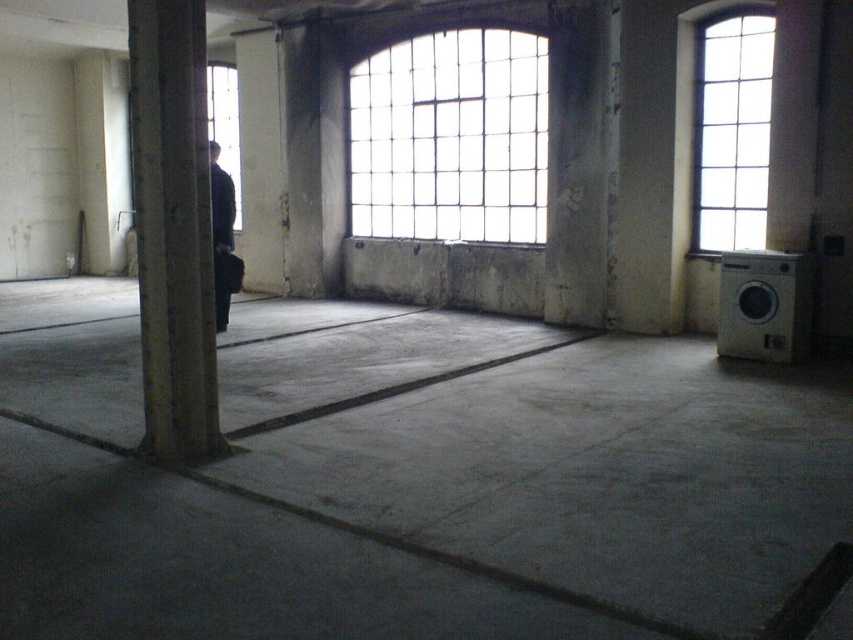
You are a painter who needs to move a ladder from the clear glass window at center to the concrete at left. The ladder is 5 meters long. Can you move it horizontally without tilting it?

The clear glass window at center and concrete at left are 5.69 meters apart from each other. Since the ladder is 5 meters long, which is shorter than the distance between them, you can move it horizontally without tilting it.